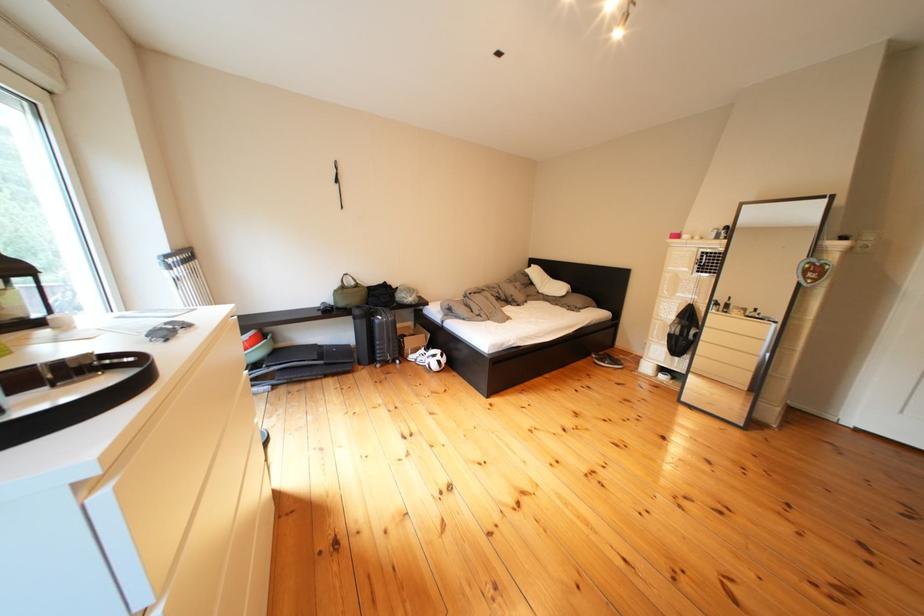
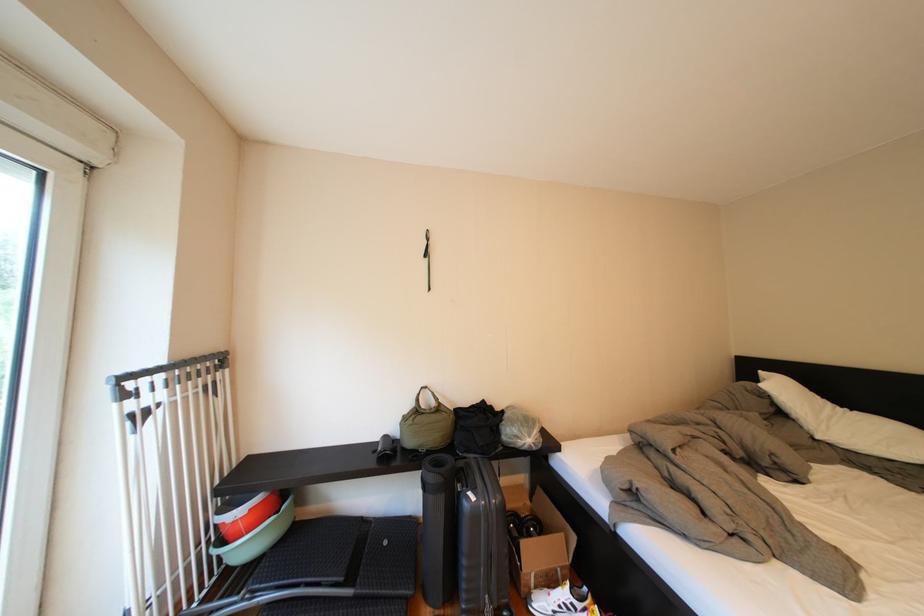
Find the pixel in the second image that matches [545,288] in the first image.

(795, 419)